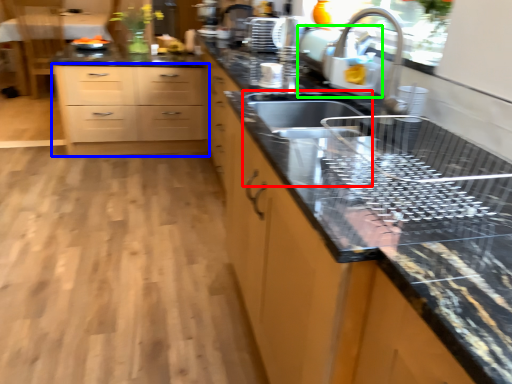
Question: Which is nearer to the sink (highlighted by a red box)? chest of drawers (highlighted by a blue box) or appliance (highlighted by a green box).

Choices:
 (A) chest of drawers
 (B) appliance

Answer: (B)